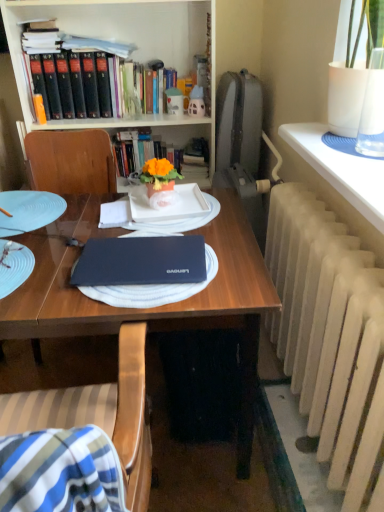
The image size is (384, 512). What are the coordinates of `vacant area situated to the left side of orange matte flower pot at center` in the screenshot? It's located at (128, 200).